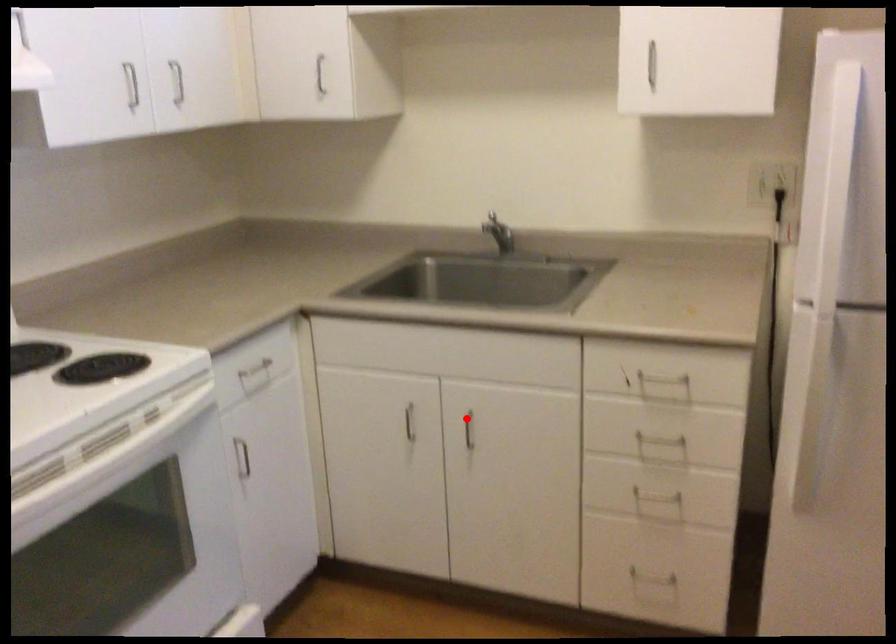
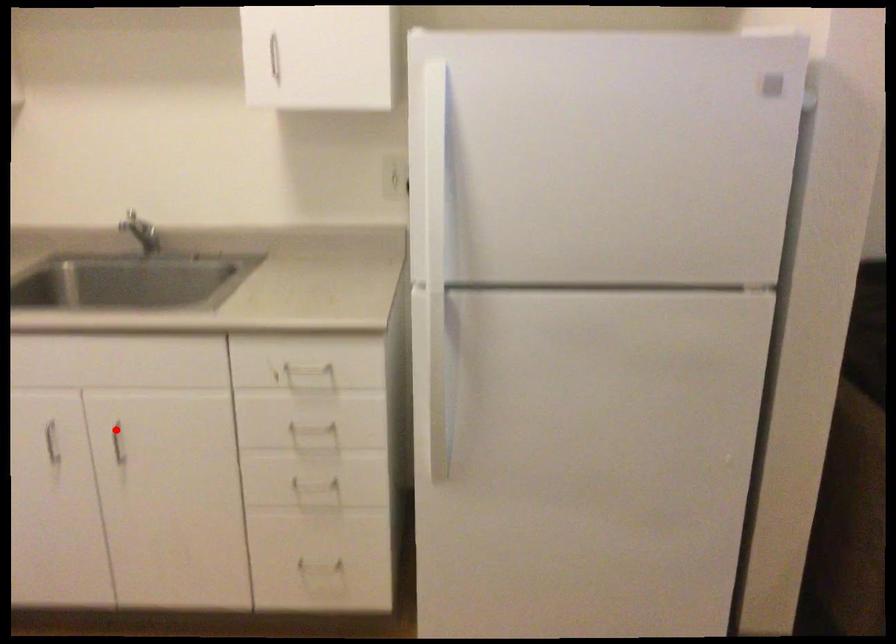
I am providing you with two images of the same scene from different viewpoints. A red point is marked on the first image and another point is marked on the second image. Are the points marked in image1 and image2 representing the same 3D position?

Yes